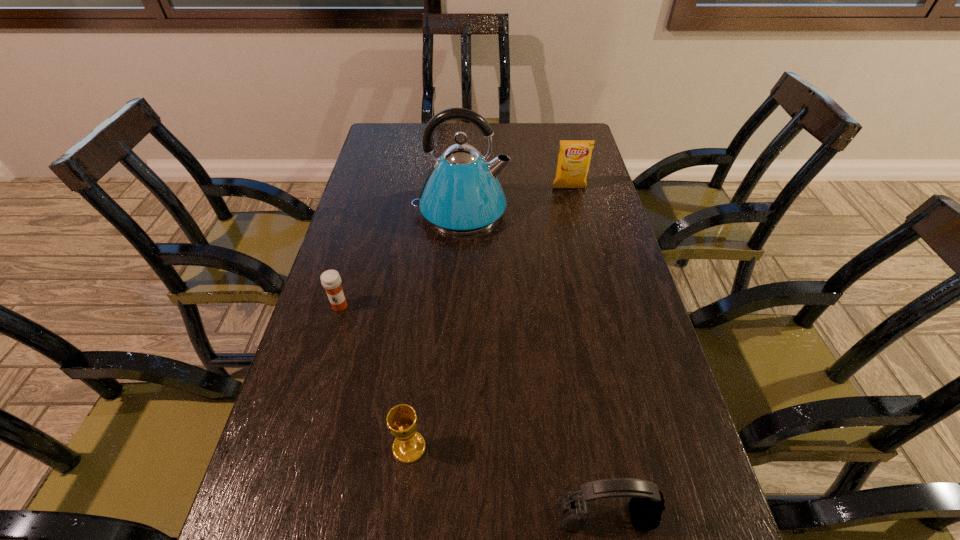
Where is `the tallest object`? the tallest object is located at coordinates (462, 195).

The width and height of the screenshot is (960, 540). Find the location of `crisp (potato chip)`. crisp (potato chip) is located at coordinates (574, 157).

Identify the location of the nearest object. This screenshot has height=540, width=960. (646, 506).

Where is `the fourth farthest object`? Image resolution: width=960 pixels, height=540 pixels. the fourth farthest object is located at coordinates (409, 445).

The image size is (960, 540). Identify the location of medicine. (331, 281).

The image size is (960, 540). Identify the location of the third farthest object. (331, 281).

Locate an element on the screen. free spot located 0.080m at the spout of the tallest object is located at coordinates (534, 212).

In order to click on free location located on the front of the crisp (potato chip) with the logo in this screenshot , I will do `click(584, 247)`.

The height and width of the screenshot is (540, 960). In order to click on vacant space located 0.210m on the right of the fourth farthest object in this screenshot , I will do `click(535, 447)`.

Image resolution: width=960 pixels, height=540 pixels. In order to click on free spot located on the label side of the third nearest object in this screenshot , I will do `click(329, 343)`.